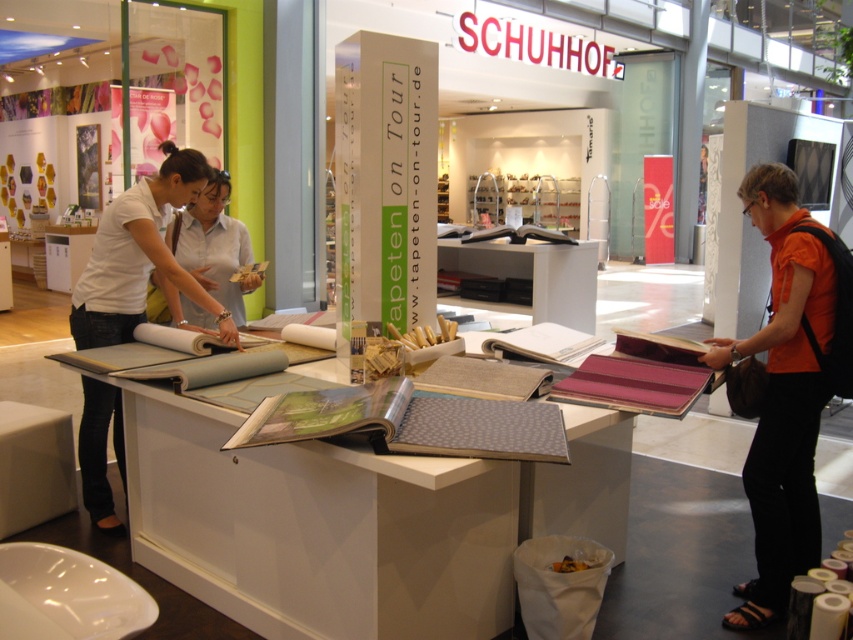
Based on the scene description, where is the orange fabric shirt at right located in terms of its 2D coordinates?

The orange fabric shirt at right is located at the 2D coordinates point (x=785, y=388).

You are a store manager who needs to ensure social distancing between customers. The recommended distance is 2 meters. Are the two customers wearing the orange fabric shirt at right and matte white blouse at left maintaining the required distance?

The orange fabric shirt at right and matte white blouse at left are 2.20 meters apart from each other, which exceeds the recommended 2 meters distance. Therefore, they are maintaining the required social distancing.

You are a customer at the Tapeten on Tour booth and notice two fabrics displayed. The orange fabric shirt at right and the white fabric at center. Which fabric is taller?

The orange fabric shirt at right is taller than the white fabric at center.